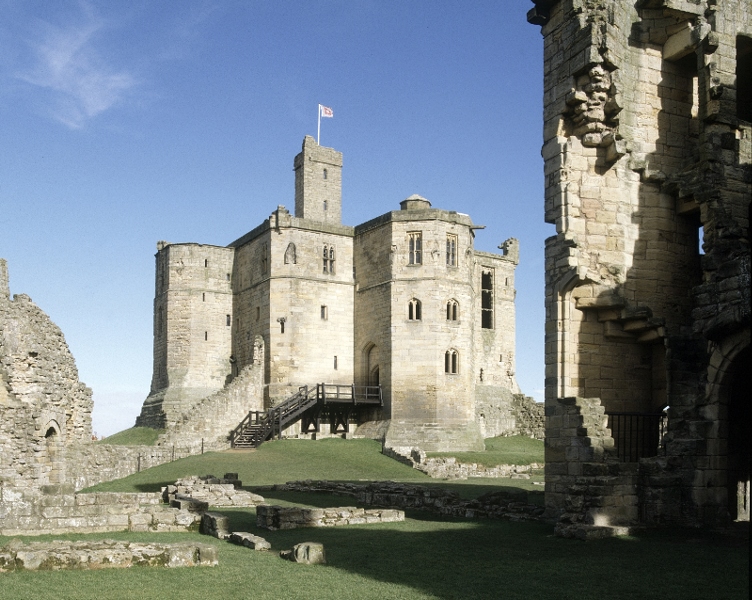
The width and height of the screenshot is (752, 600). I want to click on window, so click(x=450, y=364), click(x=447, y=312), click(x=410, y=309), click(x=411, y=250), click(x=455, y=252), click(x=484, y=284), click(x=484, y=306), click(x=481, y=325).